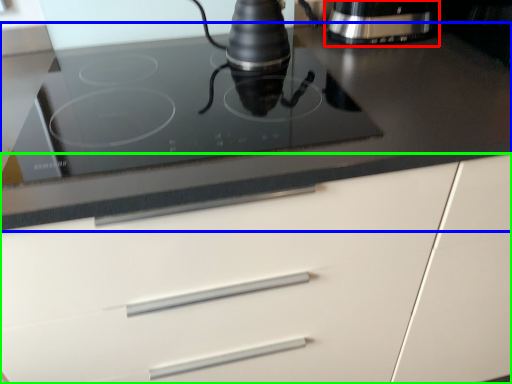
Question: Which object is the closest to the home appliance (highlighted by a red box)? Choose among these: countertop (highlighted by a blue box) or cabinetry (highlighted by a green box).

Choices:
 (A) countertop
 (B) cabinetry

Answer: (A)